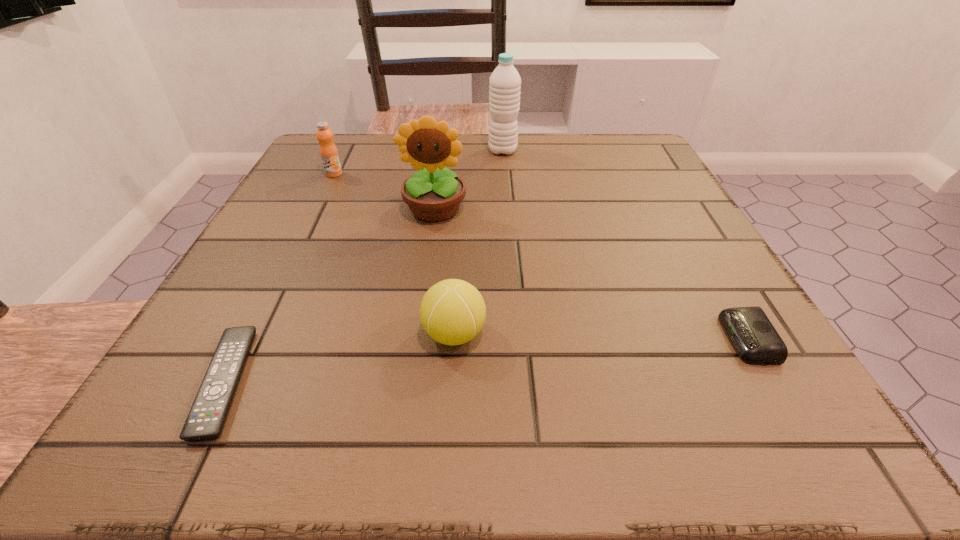
The width and height of the screenshot is (960, 540). What are the coordinates of `orange juice located at the left edge` in the screenshot? It's located at tap(328, 151).

Image resolution: width=960 pixels, height=540 pixels. What are the coordinates of `remote control that is at the left edge` in the screenshot? It's located at (205, 421).

You are a GUI agent. You are given a task and a screenshot of the screen. Output one action in this format:
    pyautogui.click(x=<x>, y=<y>)
    Task: Click on the object that is at the right edge
    The image size is (960, 540).
    Given the screenshot: What is the action you would take?
    pyautogui.click(x=753, y=336)

I want to click on object that is at the far left corner, so click(x=328, y=151).

I want to click on object present at the near left corner, so click(x=205, y=421).

Where is `blank space at the far edge`? The image size is (960, 540). blank space at the far edge is located at coordinates (552, 157).

Find the location of a particular element. The image size is (960, 540). vacant area at the near edge of the desktop is located at coordinates (550, 392).

You are a GUI agent. You are given a task and a screenshot of the screen. Output one action in this format:
    pyautogui.click(x=<x>, y=<y>)
    Task: Click on the blank space at the left edge
    Image resolution: width=960 pixels, height=540 pixels.
    Given the screenshot: What is the action you would take?
    pyautogui.click(x=300, y=196)

In the image, there is a desktop. Identify the location of free space at the right edge. (617, 185).

The image size is (960, 540). In order to click on vacant region at the far left corner of the desktop in this screenshot , I will do `click(362, 168)`.